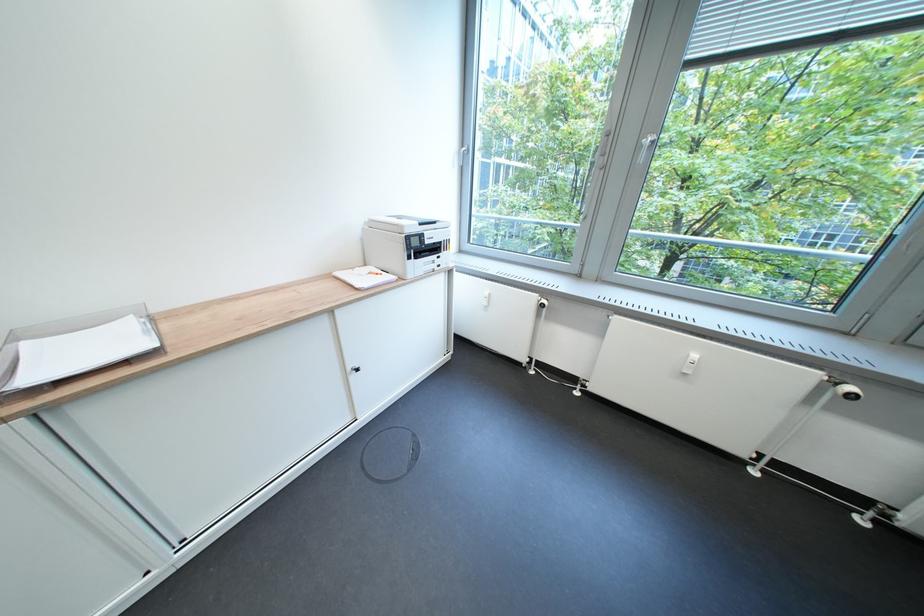
Which object does [79,350] point to?

It corresponds to the clear paper tray in the image.